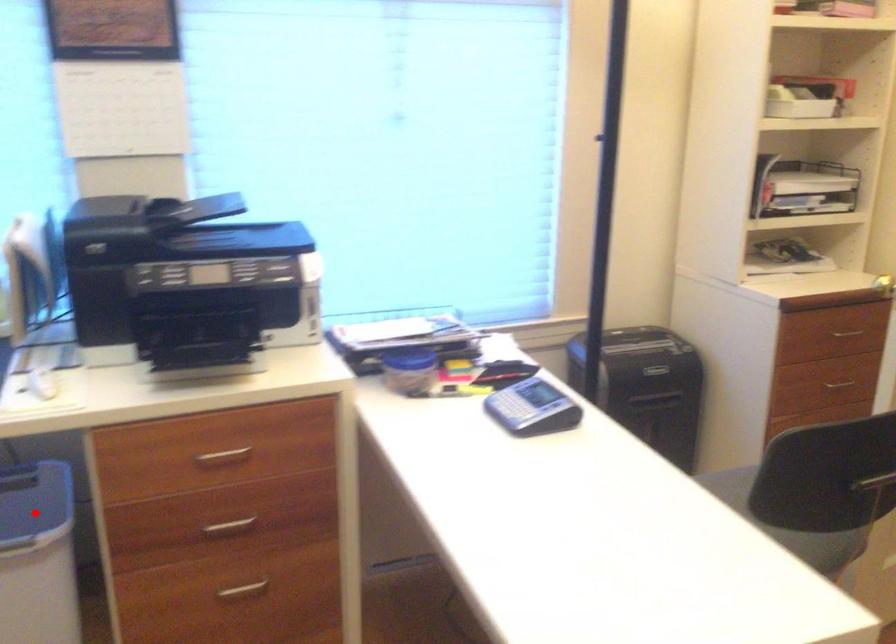
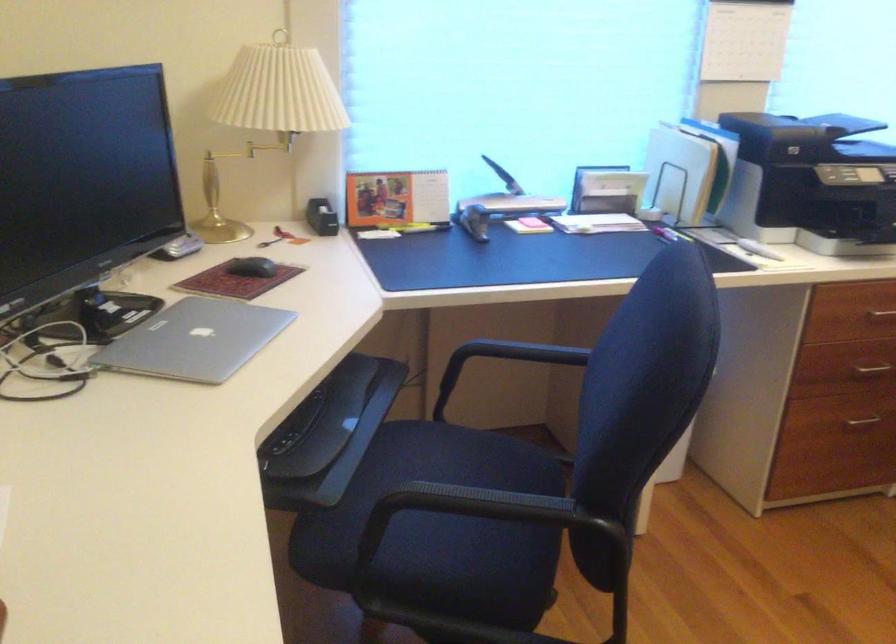
Question: I am providing you with two images of the same scene from different viewpoints. A red point is marked on the first image. Is the red point's position out of view in image 2?

Choices:
 (A) Yes
 (B) No

Answer: (A)